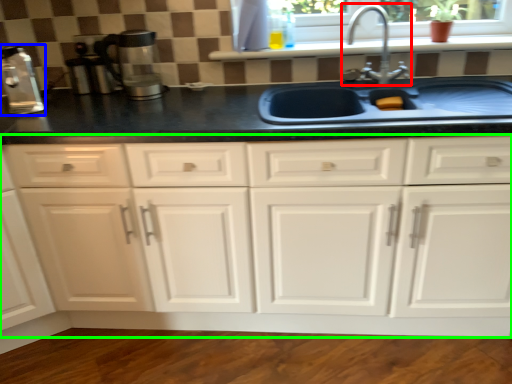
Question: Which is farther away from tap (highlighted by a red box)? coffee machine (highlighted by a blue box) or cabinetry (highlighted by a green box)?

Choices:
 (A) coffee machine
 (B) cabinetry

Answer: (A)